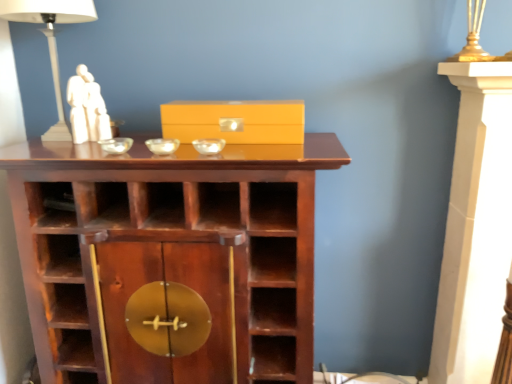
Where is `vacant space behind transparent glass bowl at center, which appears as the second glass bowl when viewed from the left`? Image resolution: width=512 pixels, height=384 pixels. vacant space behind transparent glass bowl at center, which appears as the second glass bowl when viewed from the left is located at coordinates (172, 138).